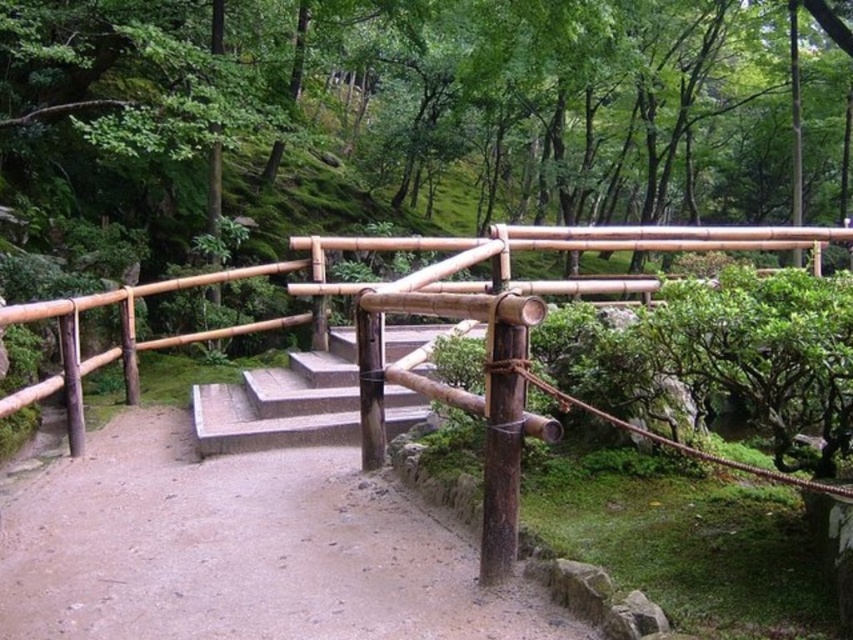
Consider the image. You are standing in the Japanese garden and want to cross the wooden bridge to reach the stone steps. The natural bamboo railing at center is in your way. Can you walk around it?

The natural bamboo railing at center is 5.80 feet away from you, so yes, you can walk around it since the distance allows enough space to move past the railing safely.

You are a gardener who wants to place a small decorative stone on the higher object between the brown gravel path at center and the natural bamboo railing at center. Which object should you choose?

The natural bamboo railing at center has a greater height than the brown gravel path at center, so you should place the decorative stone on the natural bamboo railing at center.

You are planning to place a decorative stone sculpture on the path between the natural bamboo railing at center and the smooth concrete stairs at center. Which object should the sculpture be placed closer to if you want it to appear balanced in size with its surroundings?

The natural bamboo railing at center is smaller than the smooth concrete stairs at center, so placing the decorative stone sculpture closer to the natural bamboo railing at center would create a more balanced appearance in terms of size.